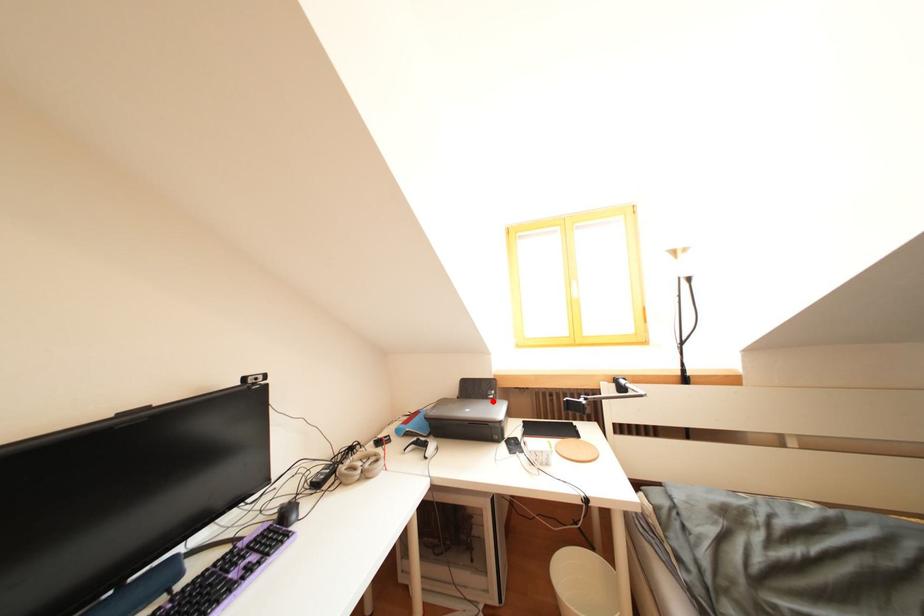
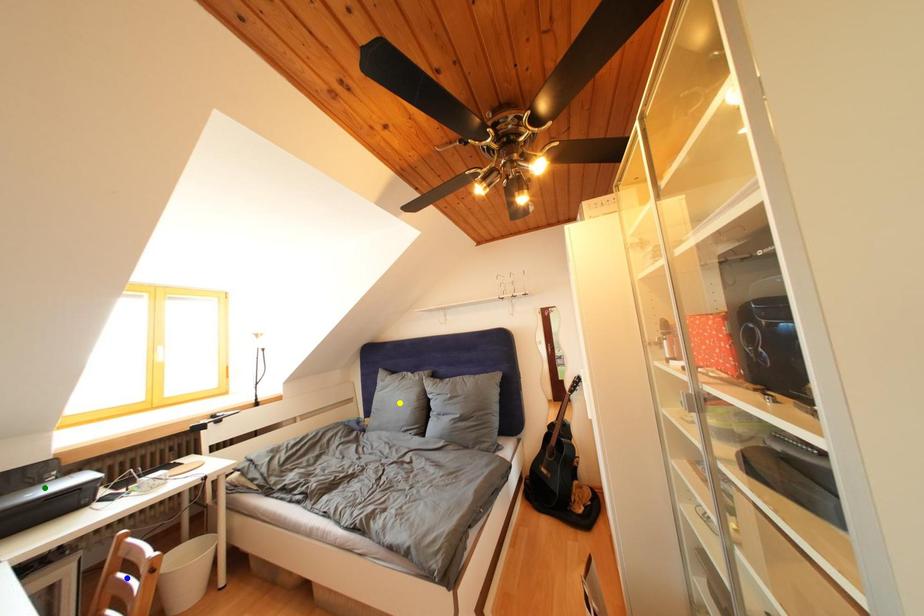
Question: I am providing you with two images of the same scene from different viewpoints. A red point is marked on the first image. You are given multiple points on the second image. Which point in image 2 represents the same 3d spot as the red point in image 1?

Choices:
 (A) blue point
 (B) yellow point
 (C) green point

Answer: (C)